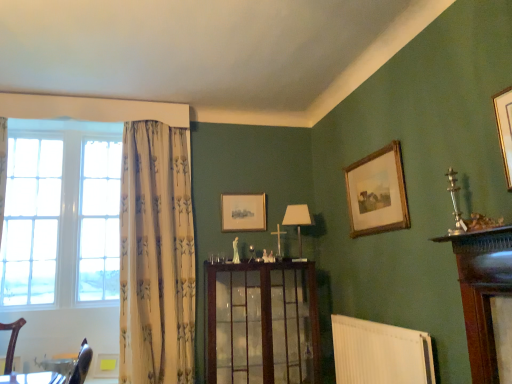
Question: Could matte wooden picture frame at center, the 1th picture frame positioned from the back, be considered to be inside white ribbed radiator at lower center?

Choices:
 (A) yes
 (B) no

Answer: (B)

Question: Is white ribbed radiator at lower center oriented away from matte wooden picture frame at center, the 1th picture frame positioned from the back?

Choices:
 (A) yes
 (B) no

Answer: (B)

Question: Can you confirm if white ribbed radiator at lower center is shorter than matte wooden picture frame at center, the 1th picture frame positioned from the back?

Choices:
 (A) no
 (B) yes

Answer: (A)

Question: From a real-world perspective, is white ribbed radiator at lower center beneath matte wooden picture frame at center, the 1th picture frame positioned from the back?

Choices:
 (A) no
 (B) yes

Answer: (B)

Question: Does white ribbed radiator at lower center appear on the left side of matte wooden picture frame at center, positioned as the 1th picture frame in left-to-right order?

Choices:
 (A) no
 (B) yes

Answer: (A)

Question: From the image's perspective, is white floral fabric curtain at left located above or below white ribbed radiator at lower center?

Choices:
 (A) above
 (B) below

Answer: (A)

Question: Is white floral fabric curtain at left taller or shorter than white ribbed radiator at lower center?

Choices:
 (A) tall
 (B) short

Answer: (A)

Question: Considering the positions of white floral fabric curtain at left and white ribbed radiator at lower center in the image, is white floral fabric curtain at left bigger or smaller than white ribbed radiator at lower center?

Choices:
 (A) small
 (B) big

Answer: (B)

Question: Relative to white ribbed radiator at lower center, is white floral fabric curtain at left in front or behind?

Choices:
 (A) behind
 (B) front

Answer: (A)

Question: Considering the positions of white fabric lampshade at center and wooden picture frame at upper right, the 2th picture frame in the left-to-right sequence, in the image, is white fabric lampshade at center taller or shorter than wooden picture frame at upper right, the 2th picture frame in the left-to-right sequence,?

Choices:
 (A) short
 (B) tall

Answer: (A)

Question: Is white fabric lampshade at center bigger or smaller than wooden picture frame at upper right, acting as the 1th picture frame starting from the right?

Choices:
 (A) small
 (B) big

Answer: (A)

Question: From a real-world perspective, is white fabric lampshade at center physically located above or below wooden picture frame at upper right, the 2th picture frame in the left-to-right sequence?

Choices:
 (A) below
 (B) above

Answer: (A)

Question: Is white fabric lampshade at center to the left or to the right of wooden picture frame at upper right, acting as the 1th picture frame starting from the right, in the image?

Choices:
 (A) left
 (B) right

Answer: (A)

Question: In the image, is white floral fabric curtain at left on the left side or the right side of white fabric lampshade at center?

Choices:
 (A) left
 (B) right

Answer: (A)

Question: Considering the positions of white floral fabric curtain at left and white fabric lampshade at center in the image, is white floral fabric curtain at left bigger or smaller than white fabric lampshade at center?

Choices:
 (A) big
 (B) small

Answer: (A)